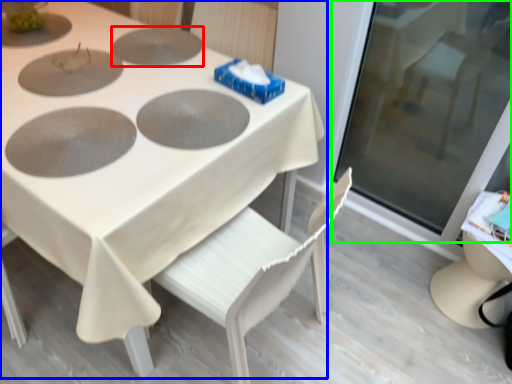
Question: Estimate the real-world distances between objects in this image. Which object is closer to pizza pan (highlighted by a red box), table (highlighted by a blue box) or glass door (highlighted by a green box)?

Choices:
 (A) table
 (B) glass door

Answer: (A)